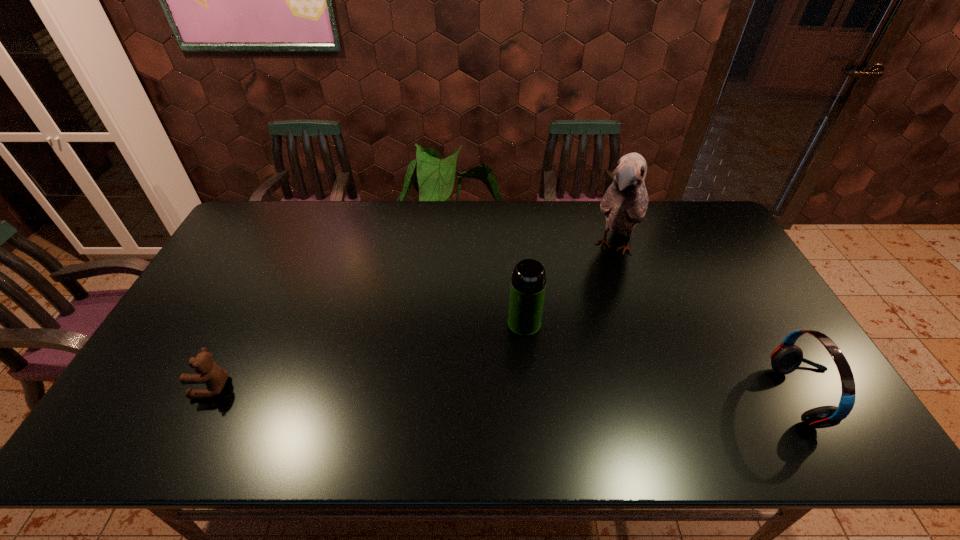
Find the location of `free spot between the teddy bear and the third object from right to left`. free spot between the teddy bear and the third object from right to left is located at coordinates (369, 355).

Locate an element on the screen. Image resolution: width=960 pixels, height=540 pixels. vacant region between the rightmost object and the tallest object is located at coordinates (713, 322).

Locate an element on the screen. empty space that is in between the leftmost object and the rightmost object is located at coordinates (512, 392).

This screenshot has width=960, height=540. I want to click on vacant space in between the farthest object and the second shortest object, so (x=713, y=322).

The width and height of the screenshot is (960, 540). I want to click on free space between the teddy bear and the rightmost object, so coord(512,392).

Where is `free space between the farthest object and the second farthest object`? Image resolution: width=960 pixels, height=540 pixels. free space between the farthest object and the second farthest object is located at coordinates (570, 286).

You are a GUI agent. You are given a task and a screenshot of the screen. Output one action in this format:
    pyautogui.click(x=<x>, y=<y>)
    Task: Click on the free area in between the third nearest object and the second shortest object
    Image resolution: width=960 pixels, height=540 pixels.
    Given the screenshot: What is the action you would take?
    pyautogui.click(x=668, y=360)

The image size is (960, 540). Identify the location of empty space that is in between the leftmost object and the headset. (512, 392).

Find the location of `free space between the shortest object and the tallest object`. free space between the shortest object and the tallest object is located at coordinates point(414,317).

Select which object is the closest to the tallest object. Please provide its 2D coordinates. Your answer should be formatted as a tuple, i.e. [(x, y)], where the tuple contains the x and y coordinates of a point satisfying the conditions above.

[(528, 283)]